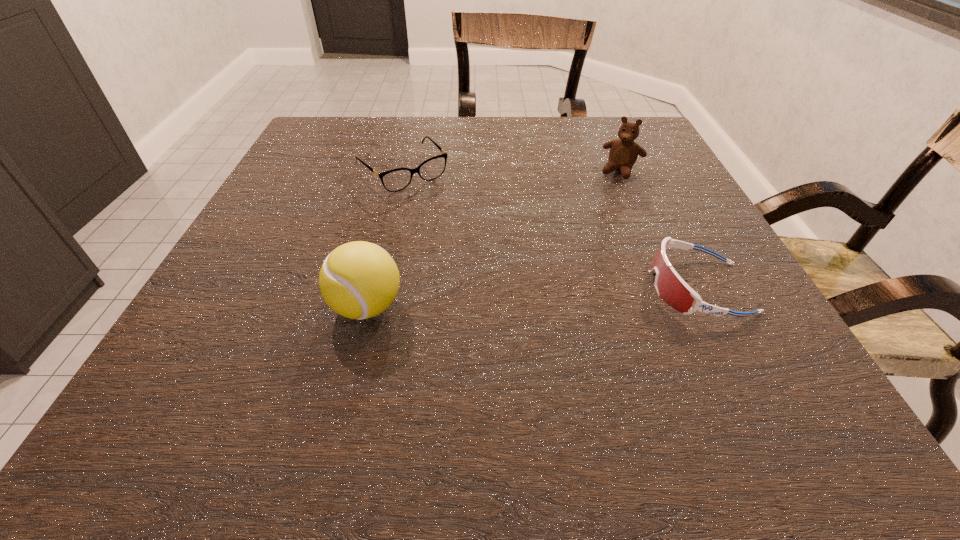
This screenshot has width=960, height=540. Identify the location of free space between the teddy bear and the shortest object. (512, 171).

Find the location of a particular element. The image size is (960, 540). vacant region between the tennis ball and the shortest object is located at coordinates (385, 239).

The height and width of the screenshot is (540, 960). Find the location of `unoccupied area between the second shortest object and the spectacles`. unoccupied area between the second shortest object and the spectacles is located at coordinates (550, 230).

The width and height of the screenshot is (960, 540). Identify the location of empty space between the teddy bear and the tennis ball. (493, 239).

The image size is (960, 540). What are the coordinates of `free space between the teddy bear and the goggles` in the screenshot? It's located at (660, 229).

You are a GUI agent. You are given a task and a screenshot of the screen. Output one action in this format:
    pyautogui.click(x=<x>, y=<y>)
    Task: Click on the vacant area that lies between the tennis ball and the teddy bear
    
    Given the screenshot: What is the action you would take?
    pyautogui.click(x=493, y=239)

The height and width of the screenshot is (540, 960). What are the coordinates of `the second closest object to the third tallest object` in the screenshot? It's located at (394, 180).

Select which object is the second closest to the teddy bear. Please provide its 2D coordinates. Your answer should be formatted as a tuple, i.e. [(x, y)], where the tuple contains the x and y coordinates of a point satisfying the conditions above.

[(394, 180)]

Where is `vacant space that satisfies the following two spatial constraints: 1. on the front side of the teddy bear; 2. on the front-facing side of the third tallest object`? The height and width of the screenshot is (540, 960). vacant space that satisfies the following two spatial constraints: 1. on the front side of the teddy bear; 2. on the front-facing side of the third tallest object is located at coordinates [672, 287].

This screenshot has width=960, height=540. What are the coordinates of `vacant space that satisfies the following two spatial constraints: 1. on the front side of the third tallest object; 2. on the front-facing side of the teddy bear` in the screenshot? It's located at (672, 287).